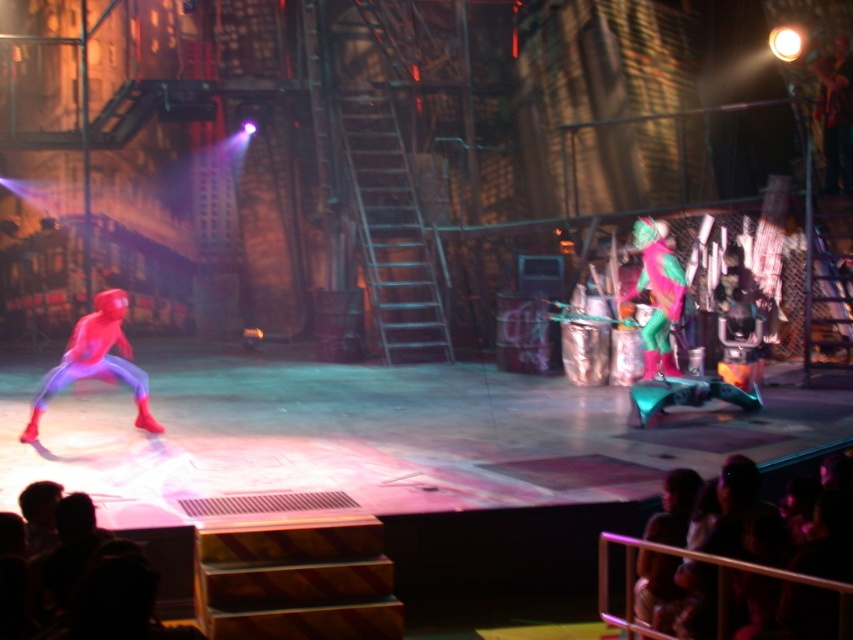
You are an audience member sitting in the front row of the theater. You notice two elements on stage that catch your attention. The first is the silky black hair at lower right and the neon green fabric costume at center. Which of these two elements appears shorter in height?

The silky black hair at lower right has a lesser height compared to the neon green fabric costume at center, so the silky black hair at lower right appears shorter in height.

You are a stagehand responsible for ensuring the performers have enough space to move. You notice the silky black hair at lower right and the neon green fabric costume at center. Which performer has a wider physical presence?

The silky black hair at lower right has a greater width than the neon green fabric costume at center, so the performer with the silky black hair at lower right has a wider physical presence.